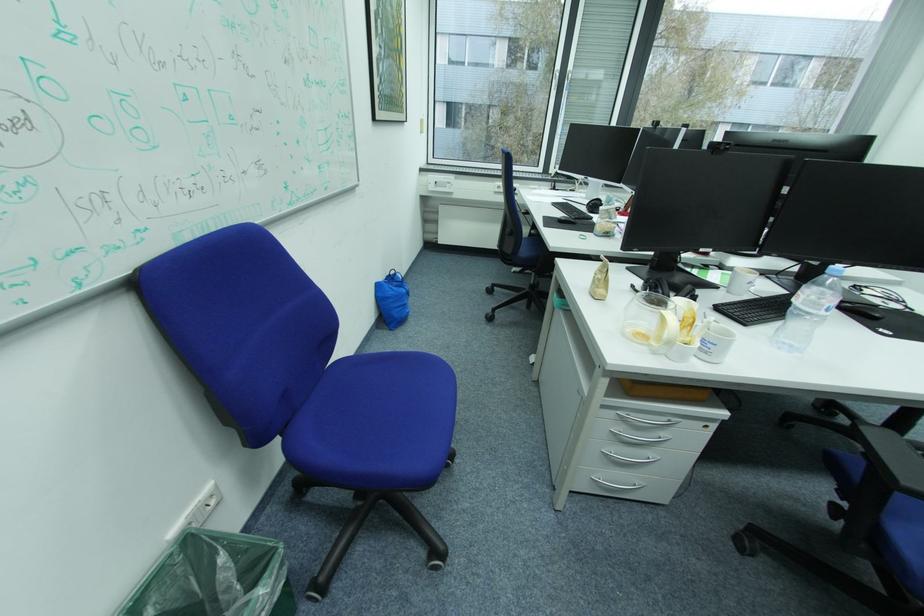
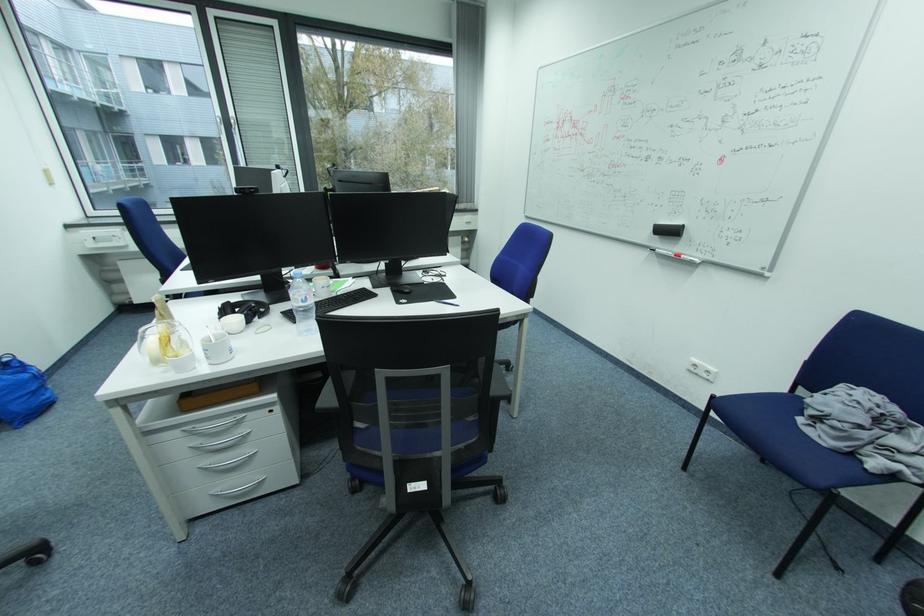
The point at (711, 342) is marked in the first image. Where is the corresponding point in the second image?

(213, 351)